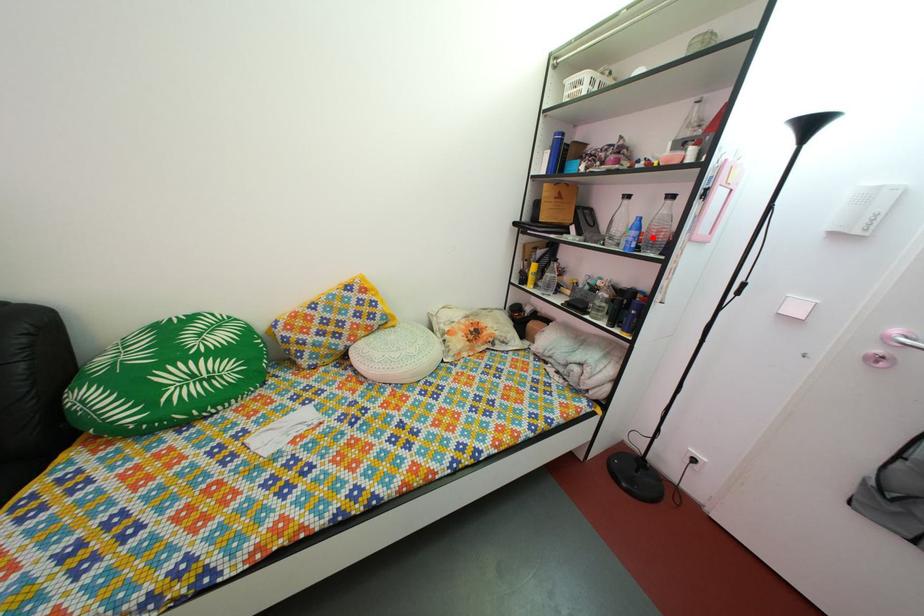
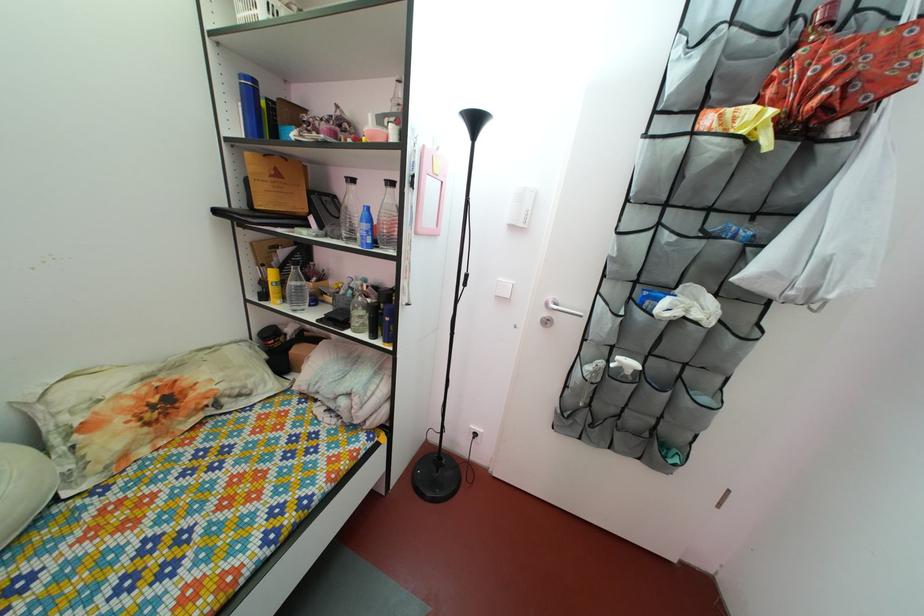
Where in the second image is the point corresponding to the highlighted location from the first image?

(383, 230)